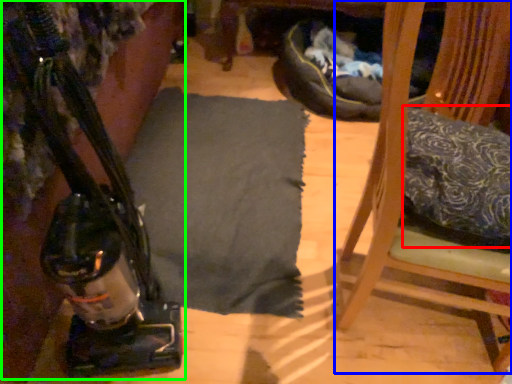
Question: Which object is the closest to the pillow (highlighted by a red box)? Choose among these: furniture (highlighted by a blue box) or job (highlighted by a green box).

Choices:
 (A) furniture
 (B) job

Answer: (A)